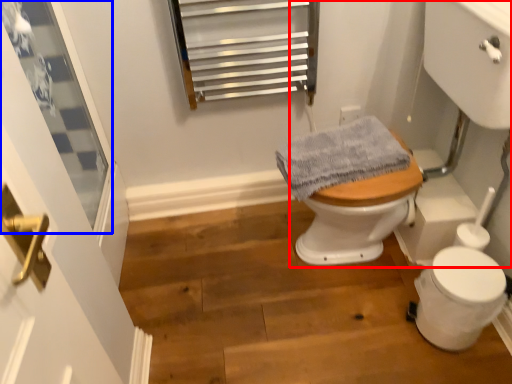
Question: Which point is closer to the camera, sink (highlighted by a red box) or window (highlighted by a blue box)?

Choices:
 (A) sink
 (B) window

Answer: (A)